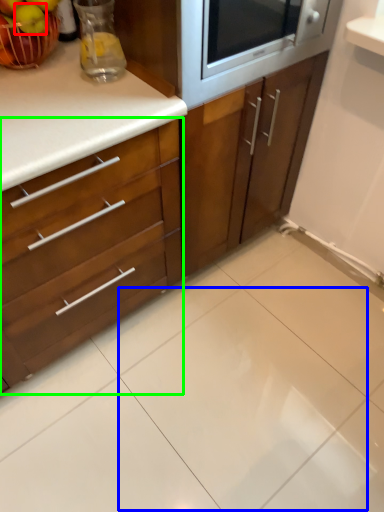
Question: Estimate the real-world distances between objects in this image. Which object is farther from apple (highlighted by a red box), ceramic tile (highlighted by a blue box) or cabinetry (highlighted by a green box)?

Choices:
 (A) ceramic tile
 (B) cabinetry

Answer: (A)